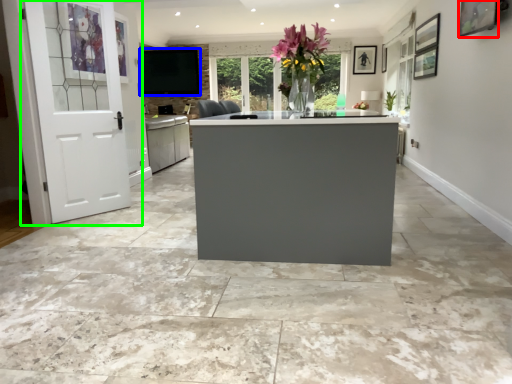
Question: Which object is positioned farthest from picture frame (highlighted by a red box)? Select from window screen (highlighted by a blue box) and door (highlighted by a green box).

Choices:
 (A) window screen
 (B) door

Answer: (A)